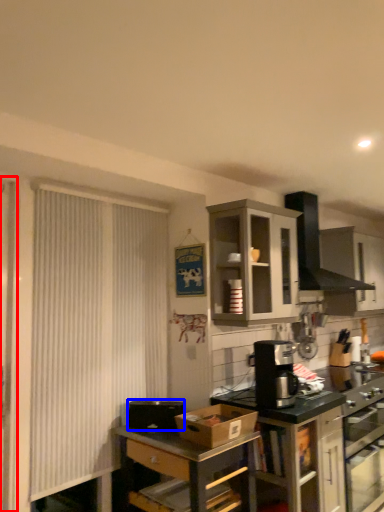
Question: Which object is further to the camera taking this photo, screen door (highlighted by a red box) or appliance (highlighted by a blue box)?

Choices:
 (A) screen door
 (B) appliance

Answer: (B)